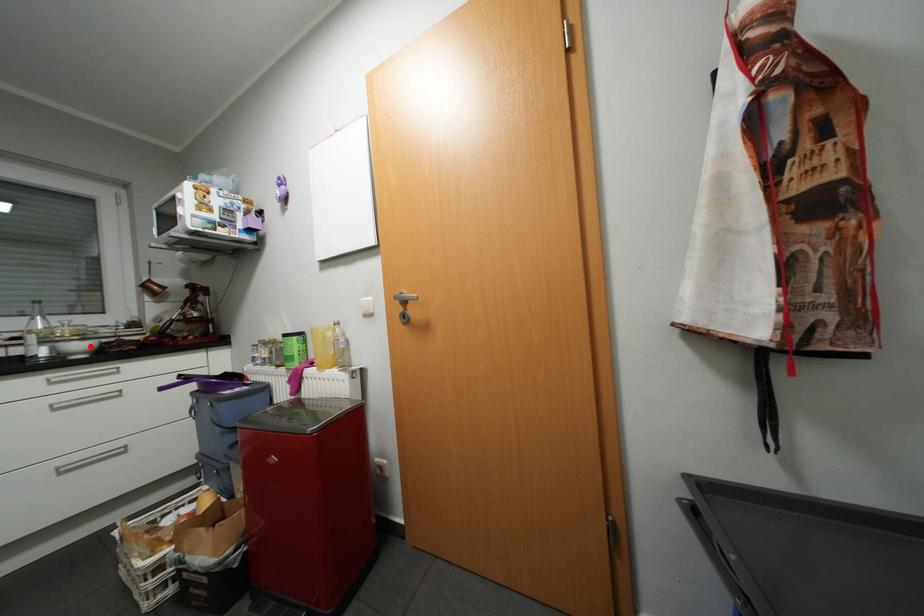
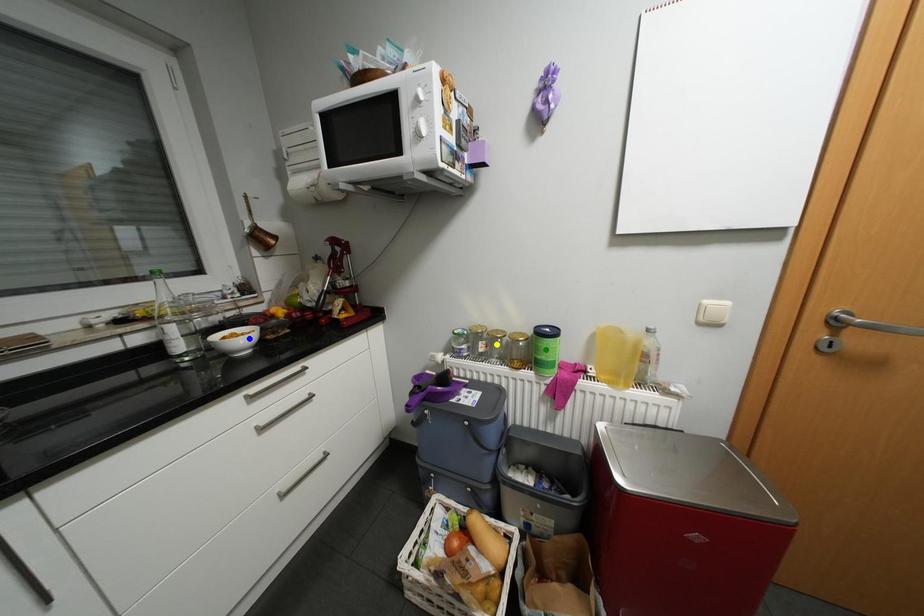
Question: I am providing you with two images of the same scene from different viewpoints. A red point is marked on the first image. You are given multiple points on the second image. Which point in image 2 represents the same 3d spot as the red point in image 1?

Choices:
 (A) green point
 (B) yellow point
 (C) blue point

Answer: (C)